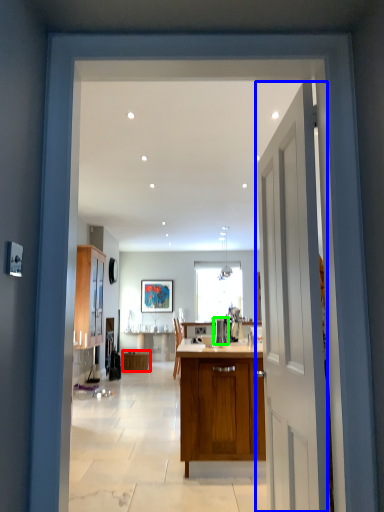
Question: Based on their relative distances, which object is nearer to cabinetry (highlighted by a red box)? Choose from door (highlighted by a blue box) and appliance (highlighted by a green box).

Choices:
 (A) door
 (B) appliance

Answer: (B)